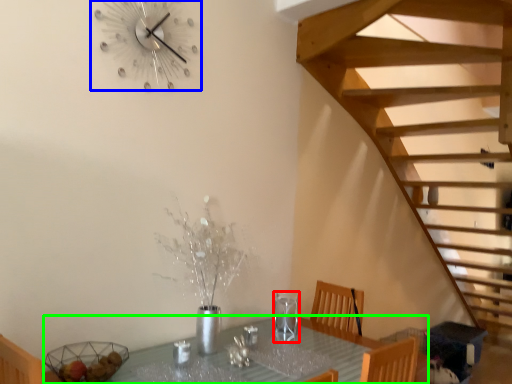
Question: Which object is the closest to the wine glass (highlighted by a red box)? Choose among these: wall clock (highlighted by a blue box) or table (highlighted by a green box).

Choices:
 (A) wall clock
 (B) table

Answer: (B)